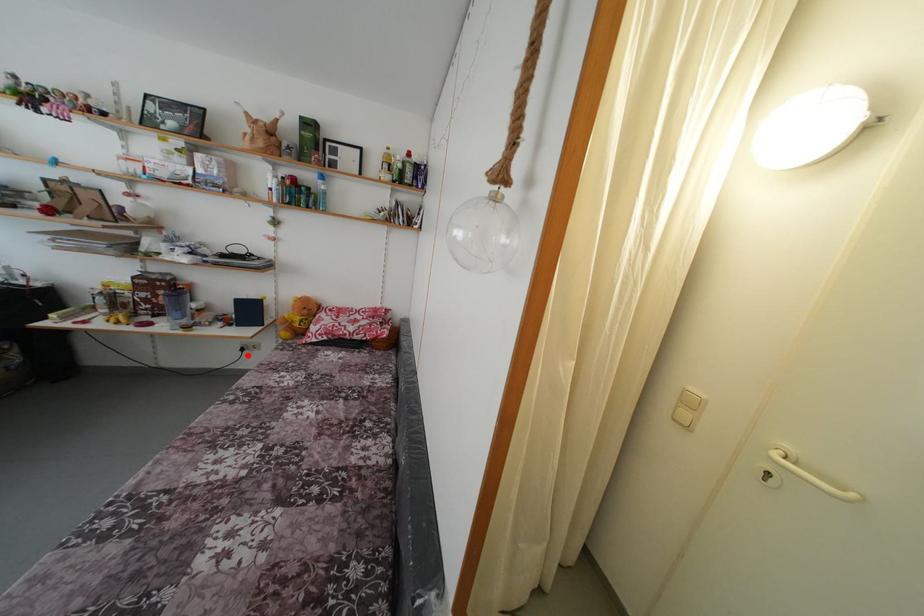
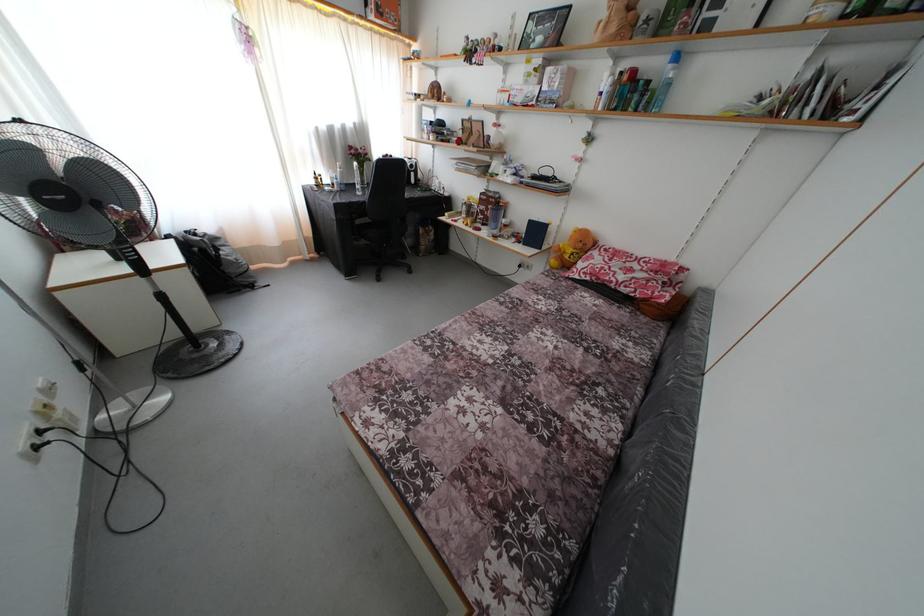
In the second image, find the point that corresponds to the highlighted location in the first image.

(525, 272)